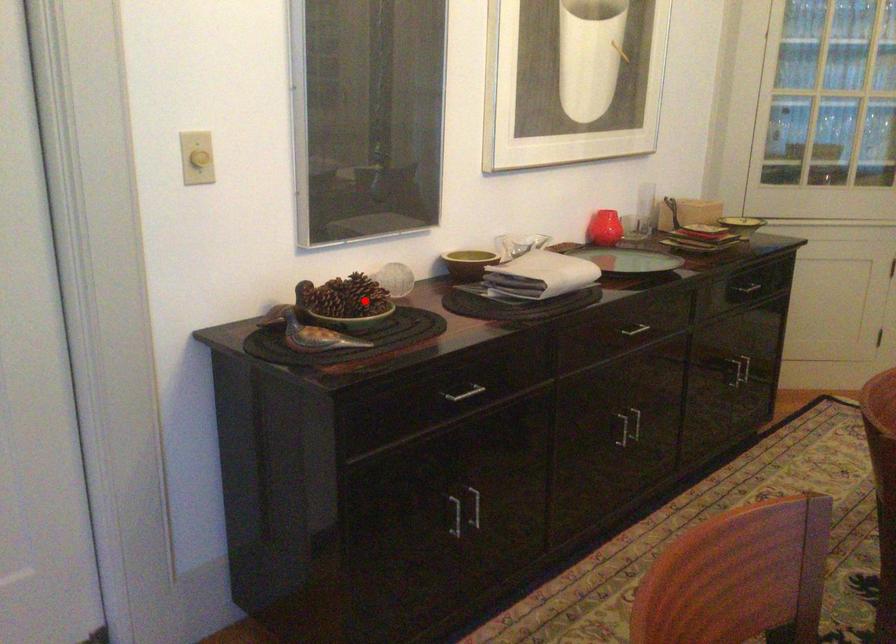
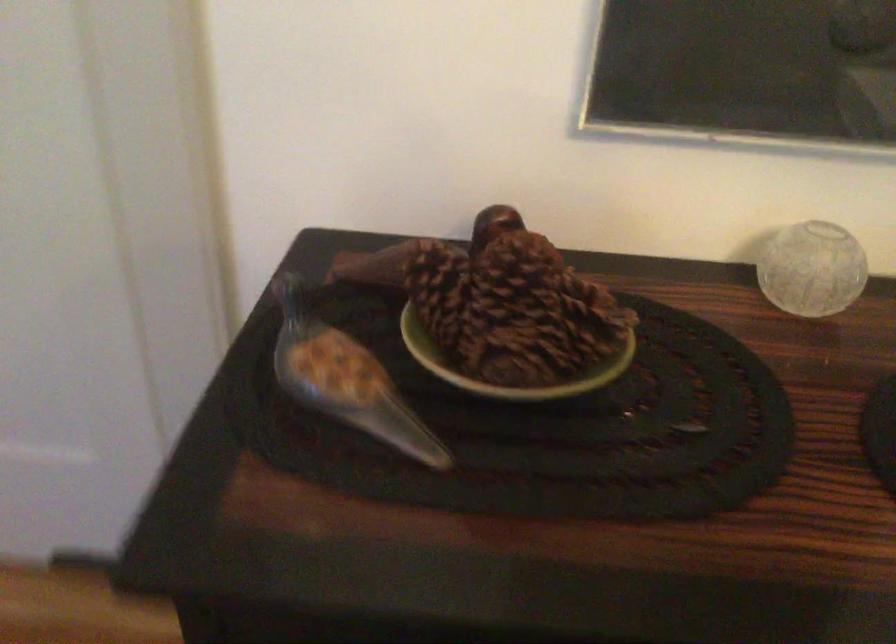
Where in the second image is the point corresponding to the highlighted location from the first image?

(506, 366)